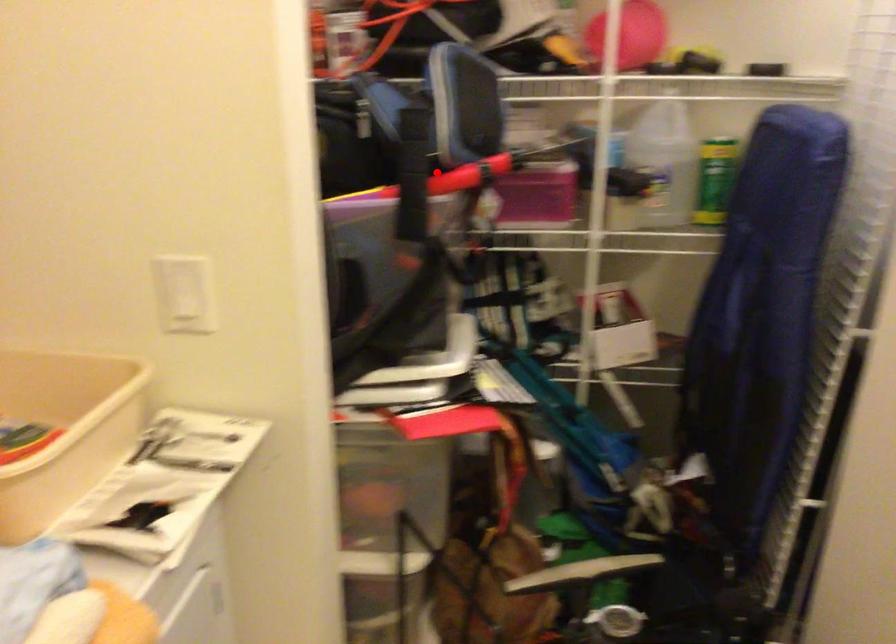
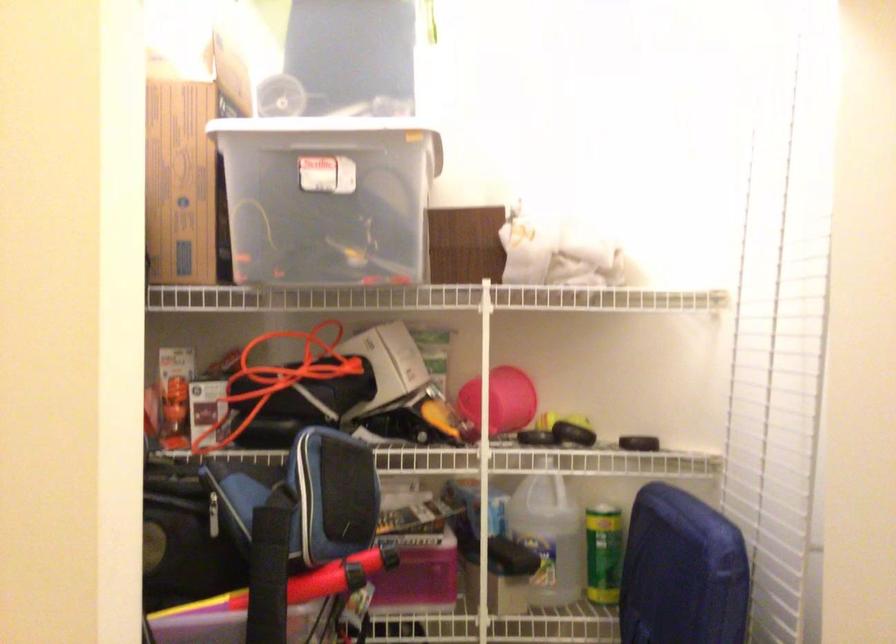
Question: I am providing you with two images of the same scene from different viewpoints. In image1, a red point is highlighted. Considering the same 3D point in image2, which of the following is correct?

Choices:
 (A) It is closer
 (B) It is farther

Answer: (A)